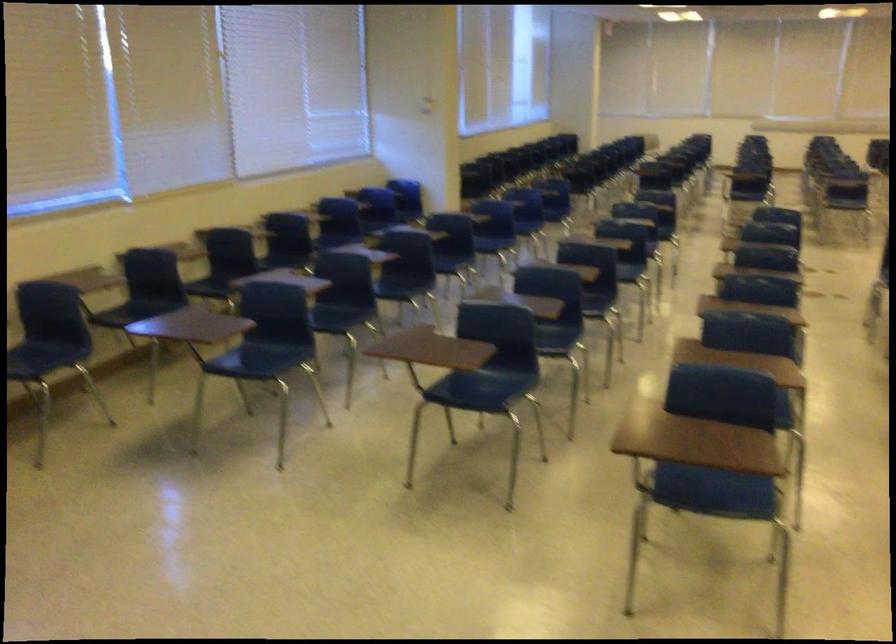
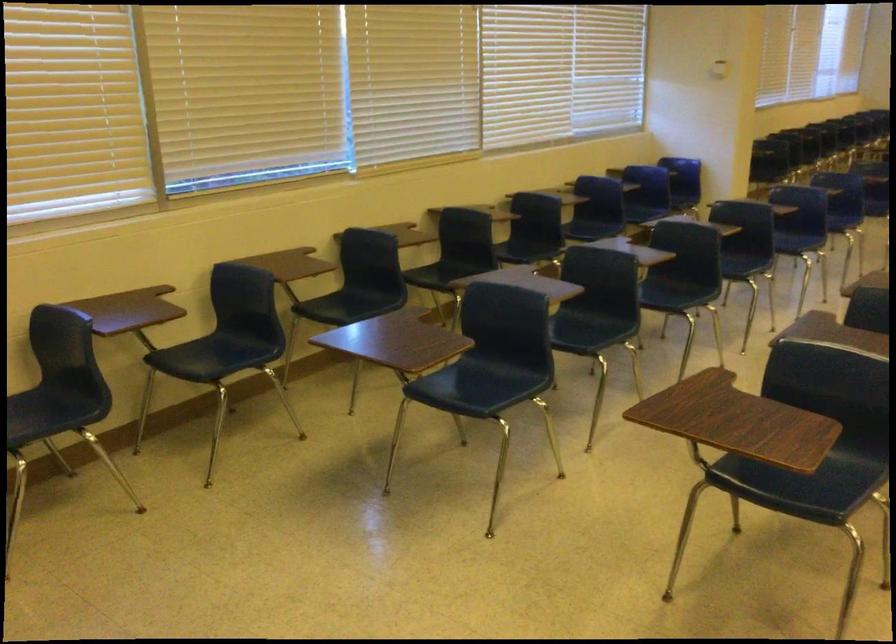
Question: The images are taken continuously from a first-person perspective. In which direction are you moving?

Choices:
 (A) Left
 (B) Right
 (C) Forward
 (D) Backward

Answer: (C)